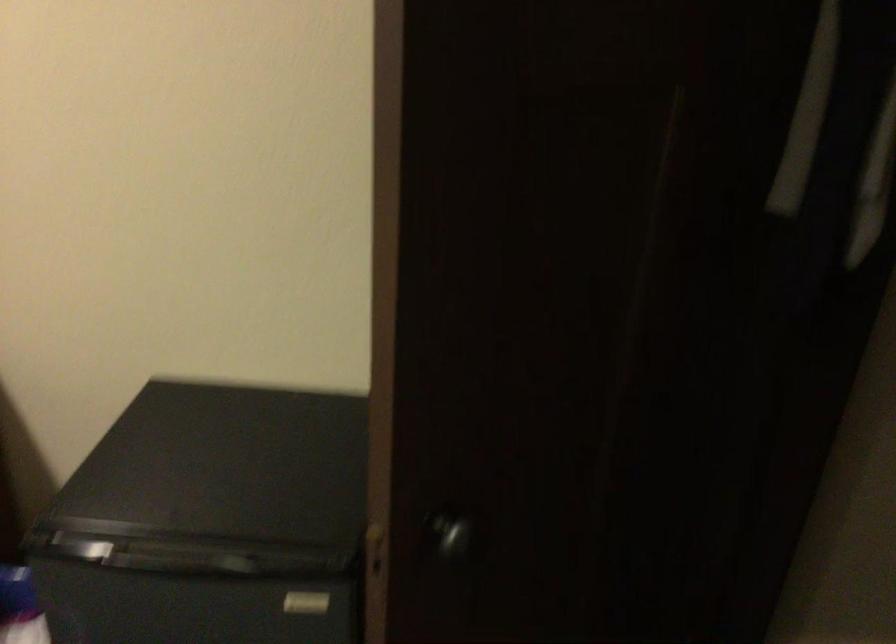
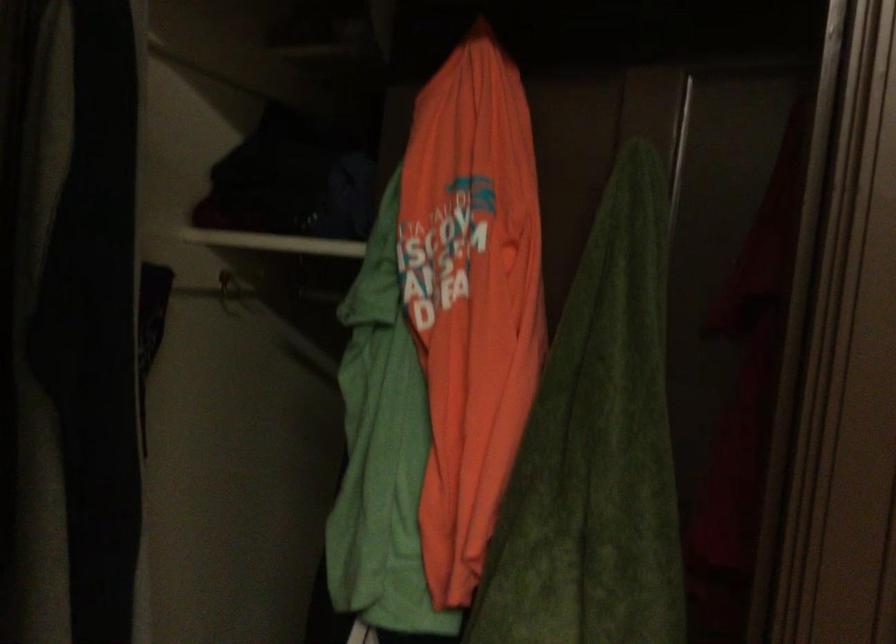
Question: How did the camera likely rotate?

Choices:
 (A) Left
 (B) Right
 (C) Up
 (D) Down

Answer: (B)